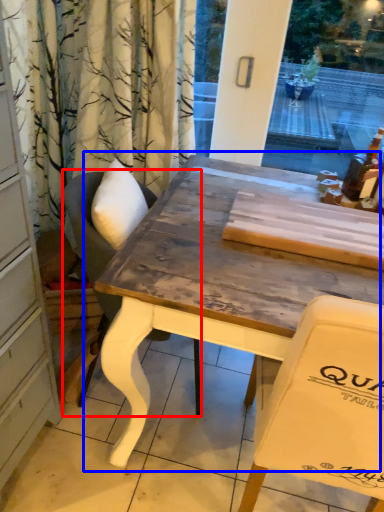
Question: Which object is further to the camera taking this photo, chair (highlighted by a red box) or table (highlighted by a blue box)?

Choices:
 (A) chair
 (B) table

Answer: (A)